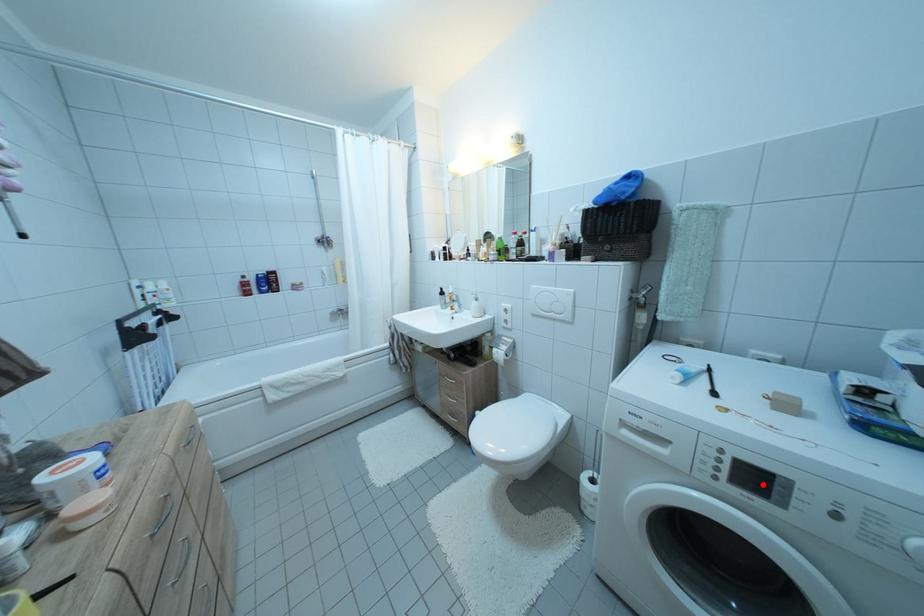
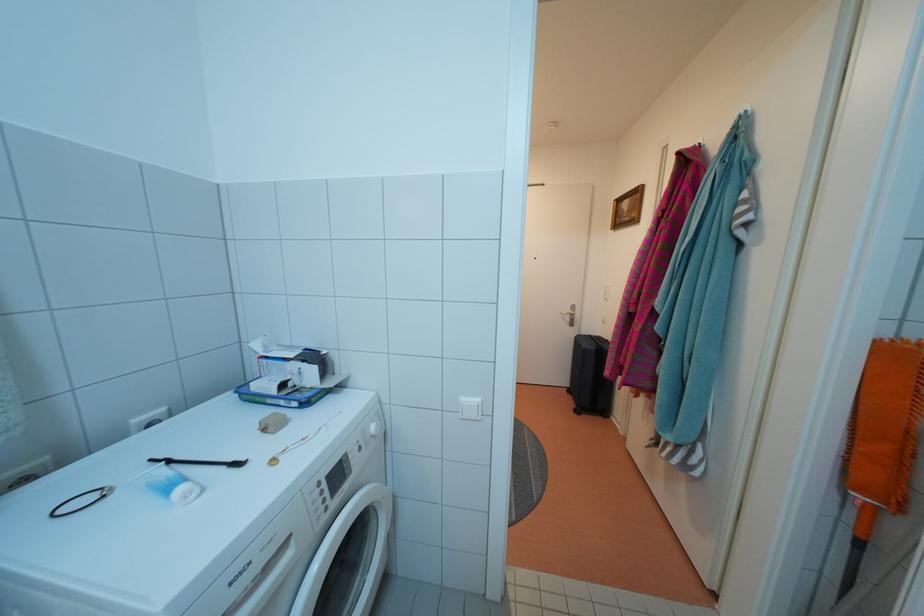
Where in the second image is the point corresponding to the highlighted location from the first image?

(345, 482)